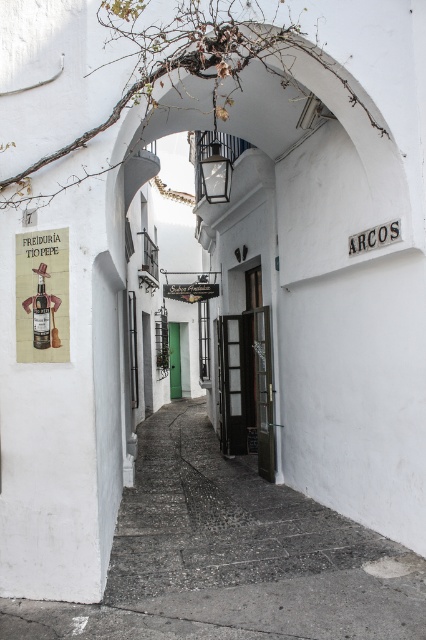
Question: Observing the image, what is the correct spatial positioning of matte paper poster at left in reference to matte glass bottle at left?

Choices:
 (A) above
 (B) below

Answer: (A)

Question: Which object is closer to the camera taking this photo?

Choices:
 (A) matte paper poster at left
 (B) matte glass bottle at left

Answer: (A)

Question: Is matte paper poster at left above matte glass bottle at left?

Choices:
 (A) no
 (B) yes

Answer: (B)

Question: Which point appears closest to the camera in this image?

Choices:
 (A) (42, 266)
 (B) (45, 269)

Answer: (B)

Question: Is matte paper poster at left closer to the viewer compared to matte glass bottle at left?

Choices:
 (A) no
 (B) yes

Answer: (B)